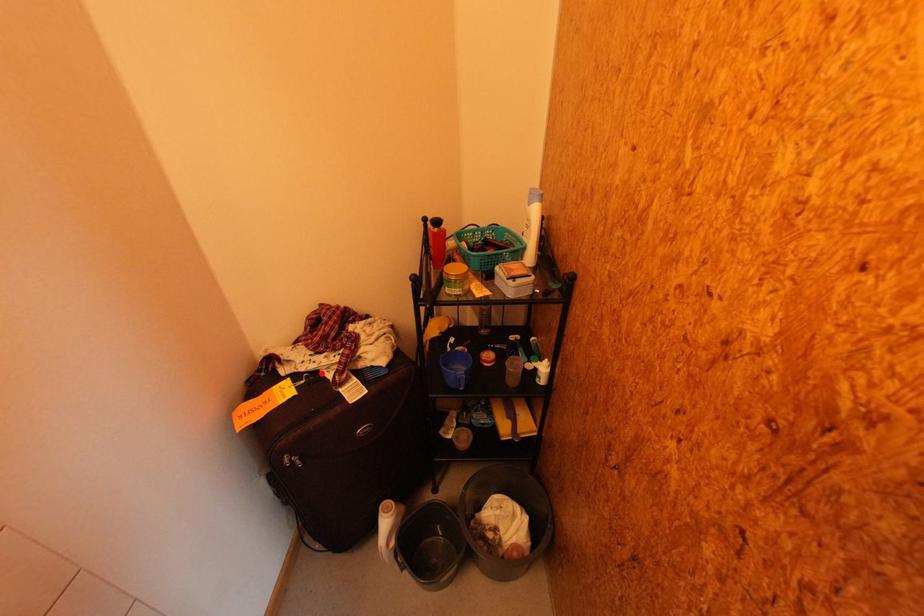
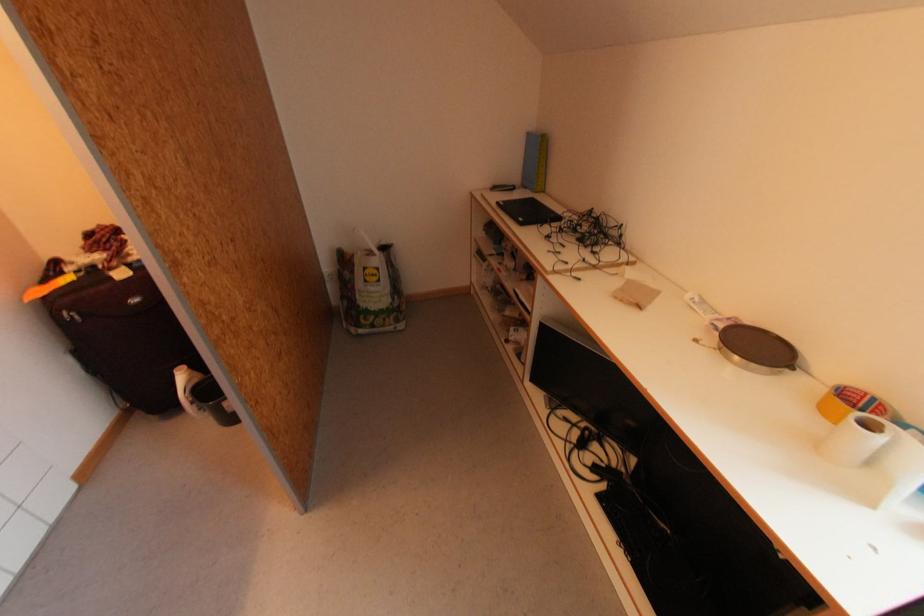
The point at the highlighted location is marked in the first image. Where is the corresponding point in the second image?

(98, 267)